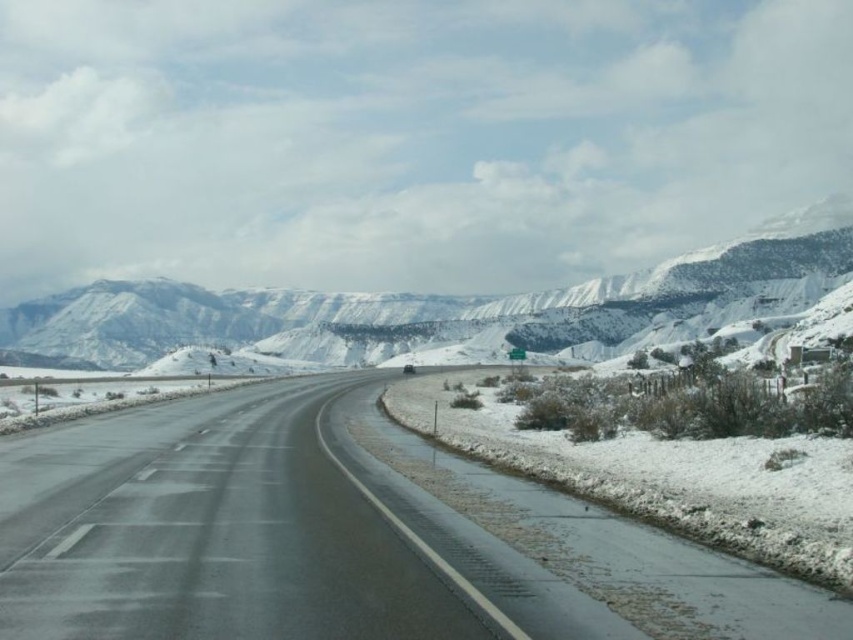
Question: Which object appears farthest from the camera in this image?

Choices:
 (A) black asphalt highway at center
 (B) snowy rocky mountain at upper center

Answer: (B)

Question: Does black asphalt highway at center appear on the right side of snowy rocky mountain at upper center?

Choices:
 (A) no
 (B) yes

Answer: (B)

Question: Which object is closer to the camera taking this photo?

Choices:
 (A) black asphalt highway at center
 (B) snowy rocky mountain at upper center

Answer: (A)

Question: From the image, what is the correct spatial relationship of black asphalt highway at center in relation to snowy rocky mountain at upper center?

Choices:
 (A) left
 (B) right

Answer: (B)

Question: Does black asphalt highway at center appear under snowy rocky mountain at upper center?

Choices:
 (A) no
 (B) yes

Answer: (B)